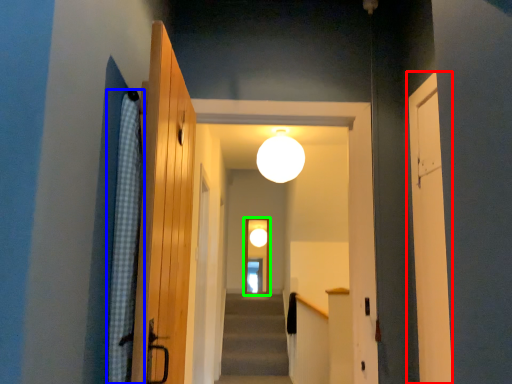
Question: Considering the real-world distances, which object is closest to door (highlighted by a red box)? curtain (highlighted by a blue box) or screen door (highlighted by a green box).

Choices:
 (A) curtain
 (B) screen door

Answer: (A)